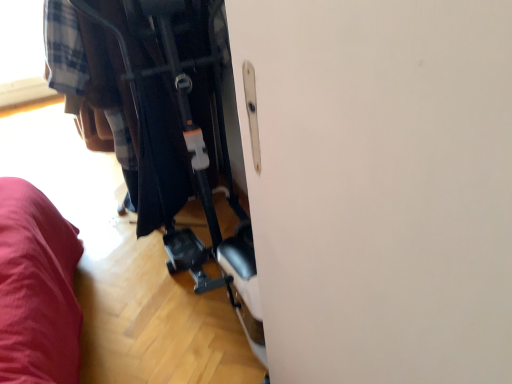
You are a GUI agent. You are given a task and a screenshot of the screen. Output one action in this format:
    pyautogui.click(x=<x>, y=<y>)
    Task: Click on the vacant area that lies between metallic black baby carriage at center and plaid fabric at center
    
    Given the screenshot: What is the action you would take?
    pyautogui.click(x=135, y=292)